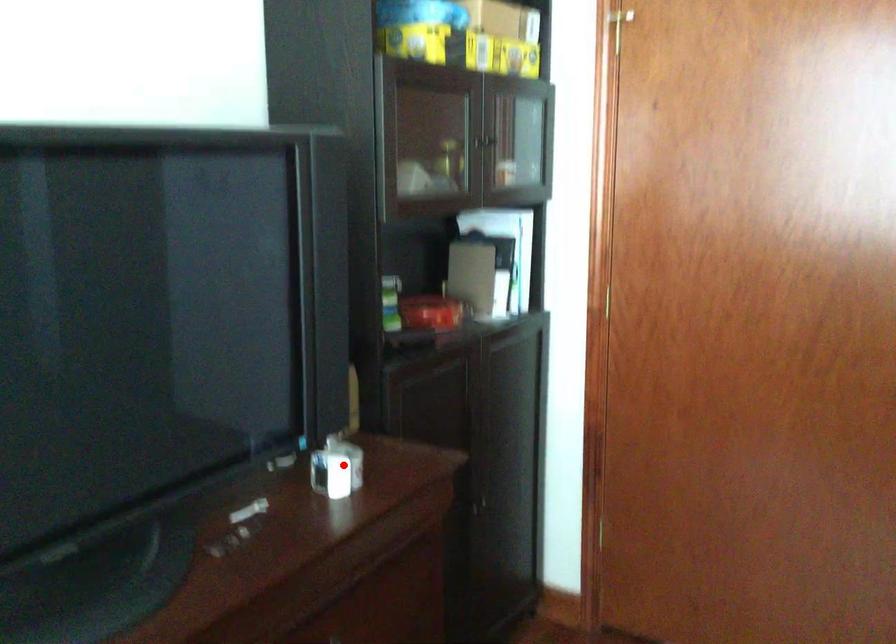
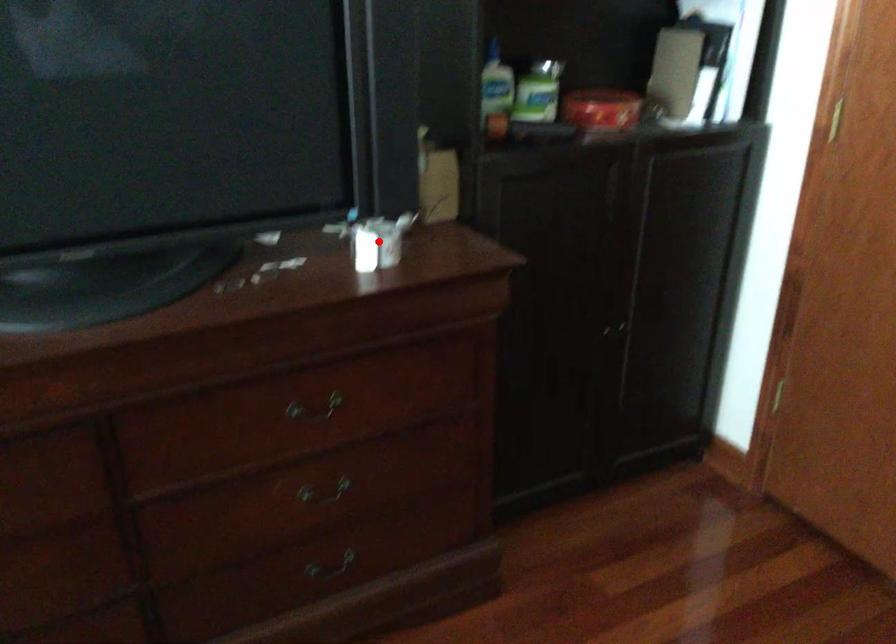
I am providing you with two images of the same scene from different viewpoints. A red point is marked on the first image and another point is marked on the second image. Does the point marked in image1 correspond to the same location as the one in image2?

Yes